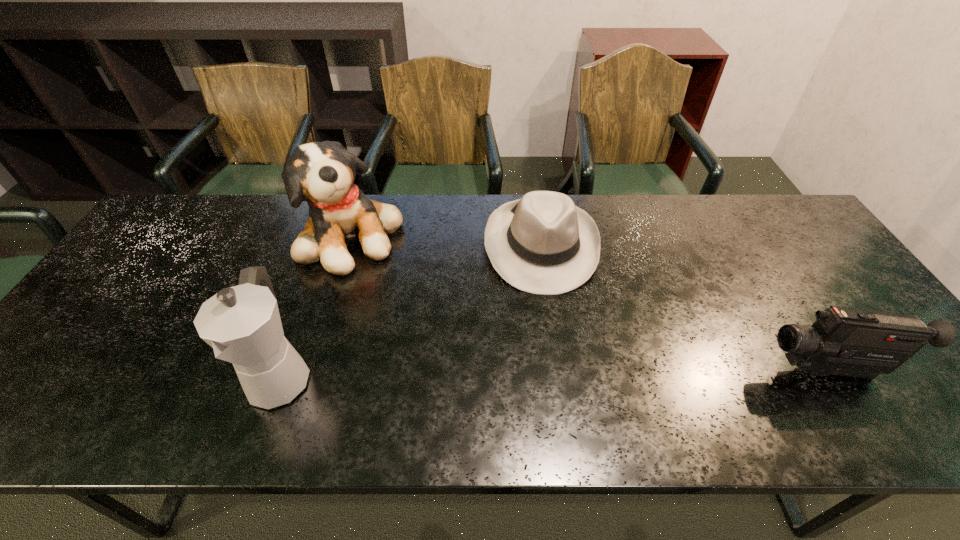
Identify the location of object at the right edge. The image size is (960, 540). (851, 342).

Image resolution: width=960 pixels, height=540 pixels. I want to click on object located in the near right corner section of the desktop, so pos(851,342).

Find the location of a particular element. This screenshot has height=540, width=960. vacant region at the far edge of the desktop is located at coordinates (665, 200).

This screenshot has width=960, height=540. Identify the location of free space at the near edge of the desktop. (176, 370).

This screenshot has width=960, height=540. What are the coordinates of `vacant space at the left edge of the desktop` in the screenshot? It's located at (134, 297).

What are the coordinates of `blank space at the right edge` in the screenshot? It's located at (792, 279).

Where is `vacant space at the far left corner of the desktop`? vacant space at the far left corner of the desktop is located at coordinates (159, 229).

Where is `vacant space at the far right corner of the desktop`? The image size is (960, 540). vacant space at the far right corner of the desktop is located at coordinates (766, 215).

Where is `empty space between the third tallest object and the puppy`? The height and width of the screenshot is (540, 960). empty space between the third tallest object and the puppy is located at coordinates (589, 304).

At what (x,y) coordinates should I click in order to perform the action: click on empty space between the coffeepot and the rightmost object. Please return your answer as a coordinate pair (x, y). The width and height of the screenshot is (960, 540). Looking at the image, I should click on (554, 374).